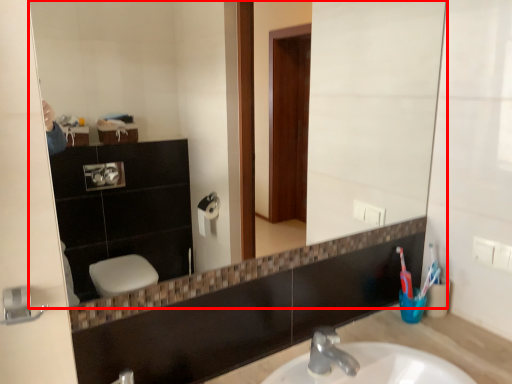
Question: From the image's perspective, where is mirror (annotated by the red box) located relative to counter top?

Choices:
 (A) above
 (B) below

Answer: (A)